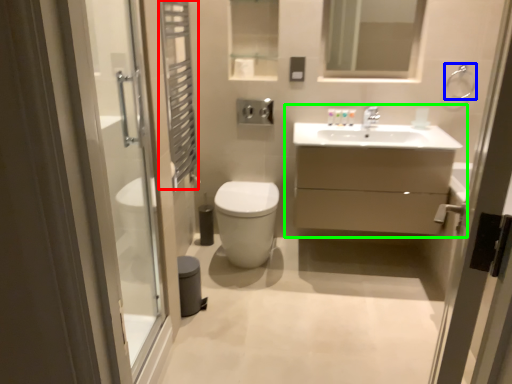
Question: Estimate the real-world distances between objects in this image. Which object is closer to shower curtain (highlighted by a red box), shower (highlighted by a blue box) or bathroom cabinet (highlighted by a green box)?

Choices:
 (A) shower
 (B) bathroom cabinet

Answer: (B)